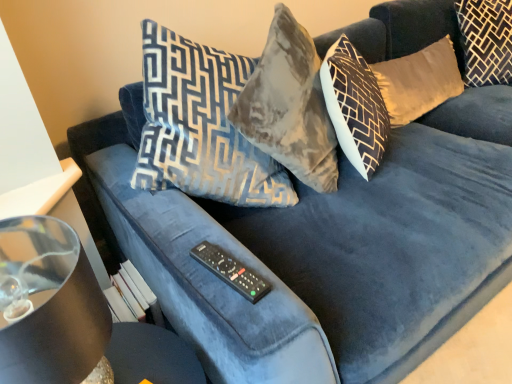
The height and width of the screenshot is (384, 512). I want to click on shiny black lampshade at left, so click(x=53, y=306).

The image size is (512, 384). Describe the element at coordinates (418, 81) in the screenshot. I see `velvet gold pillow at upper right, the 1th pillow from the left` at that location.

Where is `transparent glass table at lower left`? This screenshot has height=384, width=512. transparent glass table at lower left is located at coordinates (151, 356).

In terms of width, does transparent glass table at lower left look wider or thinner when compared to velvet gold pillow at upper right, placed as the 2th pillow when sorted from right to left?

transparent glass table at lower left is wider than velvet gold pillow at upper right, placed as the 2th pillow when sorted from right to left.

From the image's perspective, which object appears higher, transparent glass table at lower left or velvet gold pillow at upper right, placed as the 2th pillow when sorted from right to left?

velvet gold pillow at upper right, placed as the 2th pillow when sorted from right to left, from the image's perspective.

From the picture: Is there a large distance between transparent glass table at lower left and velvet gold pillow at upper right, the 1th pillow from the left?

Absolutely, transparent glass table at lower left is distant from velvet gold pillow at upper right, the 1th pillow from the left.

From a real-world perspective, between transparent glass table at lower left and velvet gold pillow at upper right, the 1th pillow from the left, who is vertically lower?

transparent glass table at lower left is physically lower.

Can you tell me how much transparent glass table at lower left and shiny black lampshade at left differ in facing direction?

They differ by 7.64 degrees in their facing directions.

From the image's perspective, is transparent glass table at lower left under shiny black lampshade at left?

Yes, from the image's perspective, transparent glass table at lower left is beneath shiny black lampshade at left.

Between point (178, 355) and point (17, 382), which one is positioned behind?

The point (178, 355) is more distant.

Which of these two, transparent glass table at lower left or shiny black lampshade at left, is bigger?

With larger size is shiny black lampshade at left.

Based on their positions, is shiny black lampshade at left located to the left or right of velvet gold pillow at upper right, the second pillow positioned from the left?

shiny black lampshade at left is positioned on velvet gold pillow at upper right, the second pillow positioned from the left,'s left side.

From the image's perspective, is shiny black lampshade at left located beneath velvet gold pillow at upper right, the second pillow positioned from the left?

Yes, from the image's perspective, shiny black lampshade at left is below velvet gold pillow at upper right, the second pillow positioned from the left.

Is shiny black lampshade at left positioned with its back to velvet gold pillow at upper right, the 1th pillow from the right?

No, shiny black lampshade at left is not facing away from velvet gold pillow at upper right, the 1th pillow from the right.

Are shiny black lampshade at left and velvet gold pillow at upper right, the second pillow positioned from the left, far apart?

shiny black lampshade at left is positioned a significant distance from velvet gold pillow at upper right, the second pillow positioned from the left.

Is shiny black lampshade at left placed right next to velvet gold pillow at upper right, the 1th pillow from the left?

There is a gap between shiny black lampshade at left and velvet gold pillow at upper right, the 1th pillow from the left.

Does shiny black lampshade at left contain velvet gold pillow at upper right, the 1th pillow from the left?

Actually, velvet gold pillow at upper right, the 1th pillow from the left, is outside shiny black lampshade at left.

From the image's perspective, count 1st pillows upward from the shiny black lampshade at left and point to it. Please provide its 2D coordinates.

[(418, 81)]

Is black plastic remote at center at the back of transparent glass table at lower left?

That's not correct — transparent glass table at lower left is not looking away from black plastic remote at center.

Considering the positions of point (133, 370) and point (219, 261), is point (133, 370) closer or farther from the camera than point (219, 261)?

Clearly, point (133, 370) is closer to the camera than point (219, 261).

Is transparent glass table at lower left smaller than black plastic remote at center?

No, transparent glass table at lower left is not smaller than black plastic remote at center.

Is black plastic remote at center in contact with transparent glass table at lower left?

No, black plastic remote at center is not in contact with transparent glass table at lower left.

The image size is (512, 384). In order to click on remote on the right of transparent glass table at lower left in this screenshot , I will do `click(231, 271)`.

Is black plastic remote at center in front of or behind transparent glass table at lower left in the image?

black plastic remote at center is behind transparent glass table at lower left.

Is point (197, 251) closer to viewer compared to point (125, 379)?

No, it is not.

Considering the points (403, 90) and (63, 320), which point is in front, point (403, 90) or point (63, 320)?

Point (63, 320)

How different are the orientations of velvet gold pillow at upper right, the 1th pillow from the left, and shiny black lampshade at left in degrees?

They differ by 5.35 degrees in their facing directions.

Considering the relative sizes of velvet gold pillow at upper right, placed as the 2th pillow when sorted from right to left, and shiny black lampshade at left in the image provided, is velvet gold pillow at upper right, placed as the 2th pillow when sorted from right to left, wider than shiny black lampshade at left?

No.

Is velvet gold pillow at upper right, the 1th pillow from the left, in front of or behind shiny black lampshade at left in the image?

Visually, velvet gold pillow at upper right, the 1th pillow from the left, is located behind shiny black lampshade at left.

Identify the location of glass table in front of the velvet gold pillow at upper right, the 1th pillow from the left. (151, 356).

Where is `lamp above the transparent glass table at lower left (from a real-world perspective)`? Image resolution: width=512 pixels, height=384 pixels. lamp above the transparent glass table at lower left (from a real-world perspective) is located at coordinates (53, 306).

Based on their spatial positions, is black plastic remote at center or velvet gold pillow at upper right, the 1th pillow from the right, closer to shiny black lampshade at left?

black plastic remote at center is closer to shiny black lampshade at left.

From the picture: Looking at the image, which one is located closer to velvet gold pillow at upper right, the second pillow positioned from the left, velvet gold pillow at upper right, placed as the 2th pillow when sorted from right to left, or transparent glass table at lower left?

Based on the image, velvet gold pillow at upper right, placed as the 2th pillow when sorted from right to left, appears to be nearer to velvet gold pillow at upper right, the second pillow positioned from the left.

From the picture: From the image, which object appears to be farther from transparent glass table at lower left, velvet gold pillow at upper right, the second pillow positioned from the left, or velvet gold pillow at upper right, the 1th pillow from the left?

Among the two, velvet gold pillow at upper right, the second pillow positioned from the left, is located further to transparent glass table at lower left.

When comparing their distances from transparent glass table at lower left, does black plastic remote at center or shiny black lampshade at left seem closer?

black plastic remote at center is positioned closer to the anchor transparent glass table at lower left.

Looking at the image, which one is located closer to transparent glass table at lower left, velvet gold pillow at upper right, placed as the 2th pillow when sorted from right to left, or black plastic remote at center?

black plastic remote at center lies closer to transparent glass table at lower left than the other object.

When comparing their distances from velvet gold pillow at upper right, the 1th pillow from the left, does black plastic remote at center or shiny black lampshade at left seem further?

shiny black lampshade at left lies further to velvet gold pillow at upper right, the 1th pillow from the left, than the other object.

Looking at the image, which one is located closer to transparent glass table at lower left, shiny black lampshade at left or velvet gold pillow at upper right, the 1th pillow from the left?

shiny black lampshade at left is positioned closer to the anchor transparent glass table at lower left.

Estimate the real-world distances between objects in this image. Which object is closer to velvet gold pillow at upper right, the second pillow positioned from the left, black plastic remote at center or velvet gold pillow at upper right, placed as the 2th pillow when sorted from right to left?

Among the two, velvet gold pillow at upper right, placed as the 2th pillow when sorted from right to left, is located nearer to velvet gold pillow at upper right, the second pillow positioned from the left.

I want to click on glass table between shiny black lampshade at left and velvet gold pillow at upper right, placed as the 2th pillow when sorted from right to left, so click(x=151, y=356).

The height and width of the screenshot is (384, 512). I want to click on remote located between transparent glass table at lower left and velvet gold pillow at upper right, the second pillow positioned from the left, in the left-right direction, so click(231, 271).

The image size is (512, 384). What are the coordinates of `remote situated between shiny black lampshade at left and velvet gold pillow at upper right, the 1th pillow from the right, from left to right` in the screenshot? It's located at (231, 271).

This screenshot has height=384, width=512. I want to click on remote located between shiny black lampshade at left and velvet gold pillow at upper right, placed as the 2th pillow when sorted from right to left, in the left-right direction, so click(231, 271).